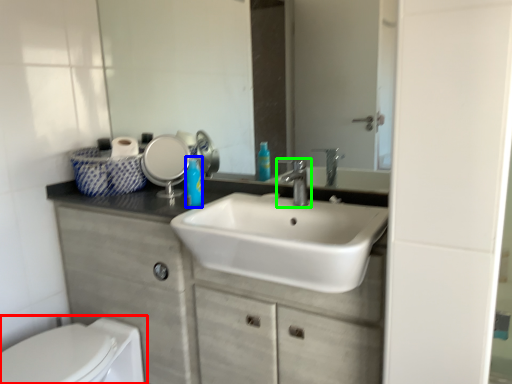
Question: Considering the real-world distances, which object is closest to toilet (highlighted by a red box)? soap dispenser (highlighted by a blue box) or tap (highlighted by a green box).

Choices:
 (A) soap dispenser
 (B) tap

Answer: (A)